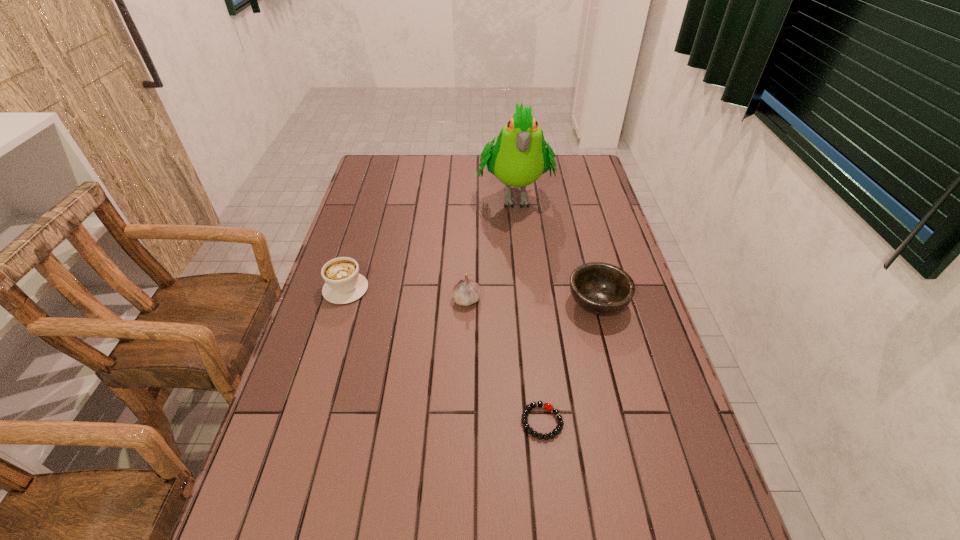
Locate an element on the screen. The width and height of the screenshot is (960, 540). the tallest object is located at coordinates (520, 156).

Locate an element on the screen. parakeet is located at coordinates (520, 156).

At what (x,y) coordinates should I click in order to perform the action: click on the second tallest object. Please return your answer as a coordinate pair (x, y). This screenshot has width=960, height=540. Looking at the image, I should click on (466, 292).

Locate an element on the screen. cappuccino is located at coordinates (344, 284).

Locate an element on the screen. Image resolution: width=960 pixels, height=540 pixels. bowl is located at coordinates (599, 288).

Identify the location of the nearest object. This screenshot has width=960, height=540. (548, 407).

Locate an element on the screen. This screenshot has height=540, width=960. bracelet is located at coordinates (548, 407).

The image size is (960, 540). I want to click on vacant area located on the beak of the farthest object, so click(518, 236).

Locate an element on the screen. free space located on the back of the second tallest object is located at coordinates (468, 243).

Locate an element on the screen. Image resolution: width=960 pixels, height=540 pixels. free space located 0.050m to the right of the cappuccino's handle is located at coordinates (354, 261).